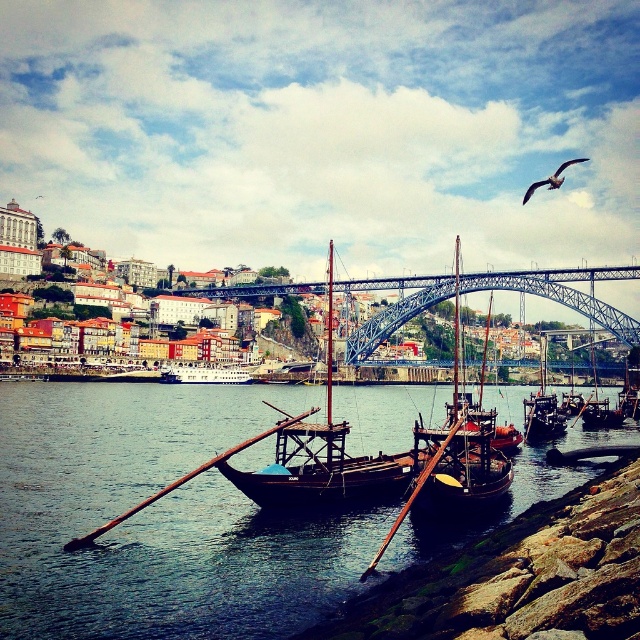
You are standing on the riverside and see the smooth dark water at center and the wooden sailboat at center. Which object is positioned to the left of the other?

The smooth dark water at center is to the left of the wooden sailboat at center.

In the scene shown: You are standing on the arched bridge and looking down at the river. You see a wooden boat at center and a white glossy boat at center. Which boat is closer to the bridge?

The wooden boat at center is below the white glossy boat at center, so the wooden boat at center is closer to the bridge.